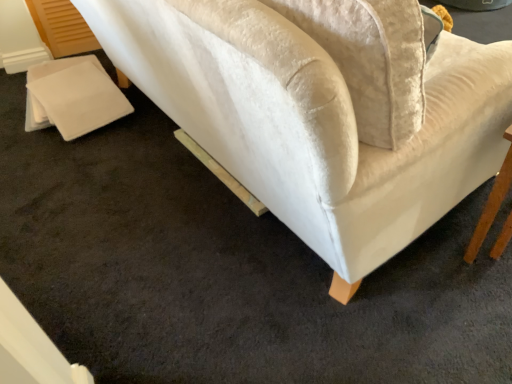
Question: Is point [468, 119] positioned closer to the camera than point [482, 216]?

Choices:
 (A) closer
 (B) farther

Answer: (A)

Question: Considering the relative positions of velvet white couch at upper right and wooden table at lower right in the image provided, is velvet white couch at upper right to the left or to the right of wooden table at lower right?

Choices:
 (A) right
 (B) left

Answer: (B)

Question: Considering their positions, is velvet white couch at upper right located in front of or behind wooden table at lower right?

Choices:
 (A) behind
 (B) front

Answer: (B)

Question: Is wooden table at lower right spatially inside velvet white couch at upper right, or outside of it?

Choices:
 (A) inside
 (B) outside

Answer: (B)

Question: Looking at their shapes, would you say wooden table at lower right is wider or thinner than velvet white couch at upper right?

Choices:
 (A) thin
 (B) wide

Answer: (A)

Question: Is wooden table at lower right bigger or smaller than velvet white couch at upper right?

Choices:
 (A) big
 (B) small

Answer: (B)

Question: From a real-world perspective, relative to velvet white couch at upper right, is wooden table at lower right vertically above or below?

Choices:
 (A) above
 (B) below

Answer: (A)